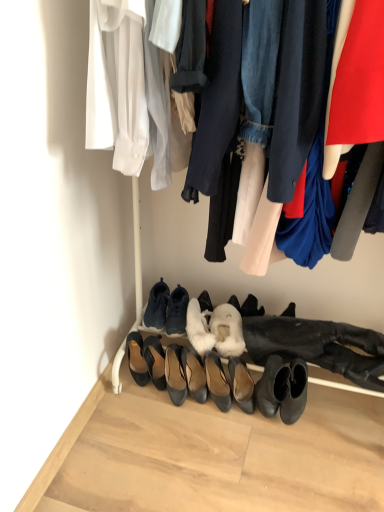
Question: From their relative heights in the image, would you say matte black heels at center, which appears as the 2th footwear when viewed from the right, is taller or shorter than matte black sneakers at center, which is the 5th footwear in left-to-right order?

Choices:
 (A) short
 (B) tall

Answer: (B)

Question: Is matte black heels at center, which appears as the 2th footwear when viewed from the right, to the left or to the right of matte black sneakers at center, which appears as the 4th footwear when viewed from the right, in the image?

Choices:
 (A) left
 (B) right

Answer: (B)

Question: Which object is the farthest from the dark gray suede sneakers at center, which is the 3th footwear in left-to-right order?

Choices:
 (A) brown leather heels at lower center, positioned as the 8th footwear in left-to-right order
 (B) white fur boot at center, which appears as the first shoe when viewed from the left
 (C) black leather heels at center, the seventh footwear when ordered from right to left
 (D) matte black heels at center, which is counted as the seventh footwear, starting from the left
 (E) matte black sneakers at center, which is the 5th footwear in left-to-right order

Answer: (A)

Question: Estimate the real-world distances between objects in this image. Which object is farther from the white fur boot at center, which ranks as the second shoe in right-to-left order?

Choices:
 (A) black leather heels at center, the 2th footwear from the left
 (B) matte black sneakers at center, which appears as the 4th footwear when viewed from the right
 (C) shiny black heels at center, marked as the 3th footwear in a right-to-left arrangement
 (D) brown leather heels at lower center, positioned as the 8th footwear in left-to-right order
 (E) matte black heels at center, which appears as the 2th footwear when viewed from the right

Answer: (D)